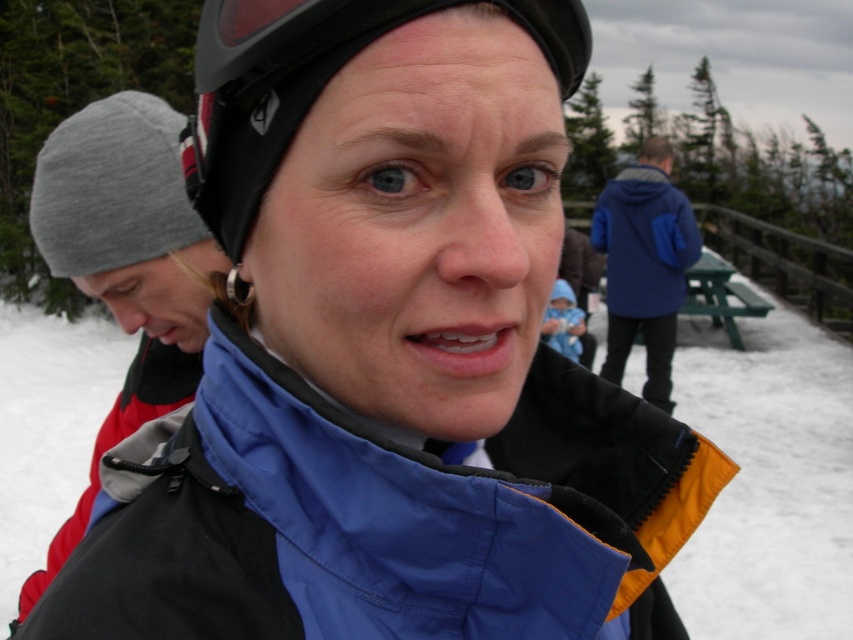
Question: Which of the following is the farthest from the observer?

Choices:
 (A) (572, 602)
 (B) (654, 392)

Answer: (B)

Question: Is gray knit beanie at left behind black matte helmet at center?

Choices:
 (A) yes
 (B) no

Answer: (A)

Question: Considering the real-world distances, which object is farthest from the black matte helmet at center?

Choices:
 (A) blue fabric jacket at center
 (B) gray knit beanie at left
 (C) blue fleece jacket at right

Answer: (C)

Question: Where is blue fabric jacket at center located in relation to black matte helmet at center in the image?

Choices:
 (A) above
 (B) below

Answer: (B)

Question: Can you confirm if gray knit beanie at left is positioned above blue fleece jacket at right?

Choices:
 (A) no
 (B) yes

Answer: (A)

Question: Which point appears closest to the camera in this image?

Choices:
 (A) (258, 588)
 (B) (312, 8)
 (C) (136, 241)
 (D) (631, 260)

Answer: (B)